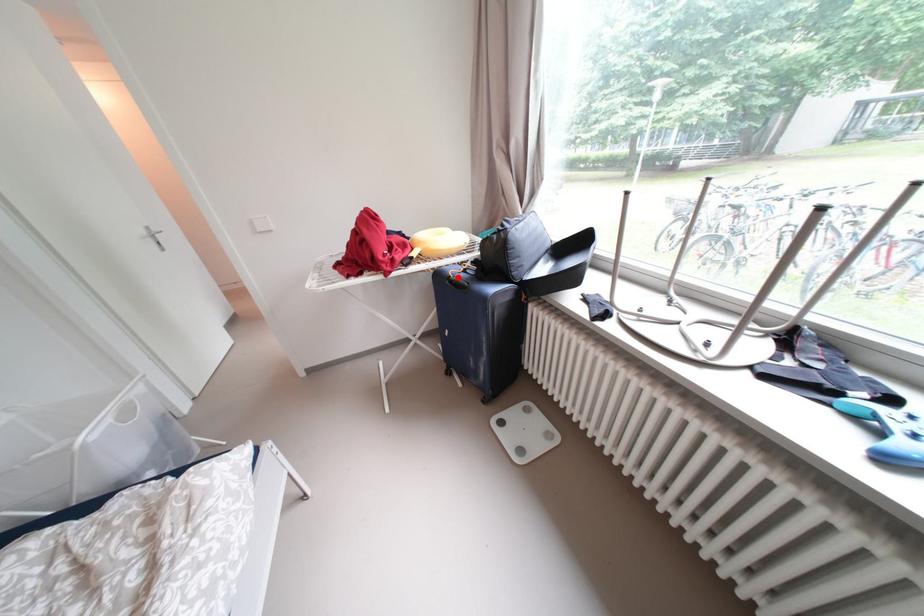
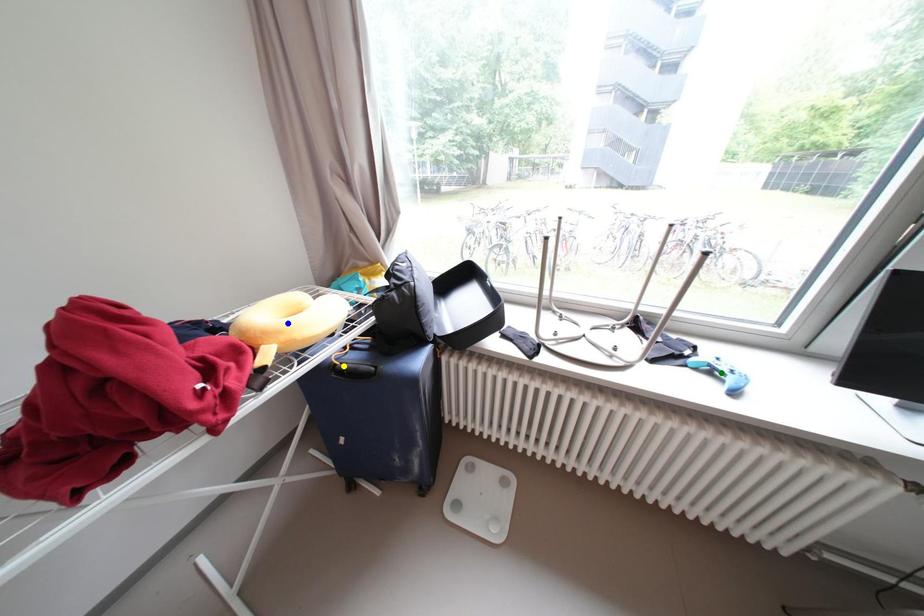
Question: I am providing you with two images of the same scene from different viewpoints. A red point is marked on the first image. You are given multiple points on the second image. Which mark in image 2 goes with the point in image 1?

Choices:
 (A) yellow point
 (B) blue point
 (C) green point

Answer: (A)